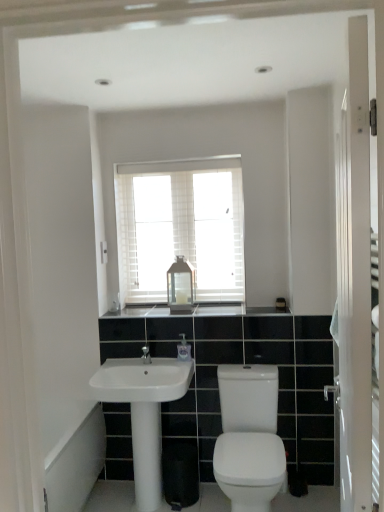
Question: Is black granite countertop at center smaller than white glossy screen door at right?

Choices:
 (A) yes
 (B) no

Answer: (A)

Question: From a real-world perspective, is black granite countertop at center located beneath white glossy screen door at right?

Choices:
 (A) no
 (B) yes

Answer: (B)

Question: Is black granite countertop at center further to the viewer compared to white glossy screen door at right?

Choices:
 (A) no
 (B) yes

Answer: (B)

Question: Can white glossy screen door at right be found inside black granite countertop at center?

Choices:
 (A) yes
 (B) no

Answer: (B)

Question: From a real-world perspective, does black granite countertop at center stand above white glossy screen door at right?

Choices:
 (A) yes
 (B) no

Answer: (B)

Question: Based on their sizes in the image, would you say white glossy toilet at lower right is bigger or smaller than white glossy sink at center?

Choices:
 (A) big
 (B) small

Answer: (A)

Question: From their relative heights in the image, would you say white glossy toilet at lower right is taller or shorter than white glossy sink at center?

Choices:
 (A) tall
 (B) short

Answer: (A)

Question: Considering the positions of point (253, 459) and point (173, 359), is point (253, 459) closer or farther from the camera than point (173, 359)?

Choices:
 (A) closer
 (B) farther

Answer: (A)

Question: In the image, is white glossy toilet at lower right on the left side or the right side of white glossy sink at center?

Choices:
 (A) right
 (B) left

Answer: (A)

Question: Considering the positions of point (140, 461) and point (112, 372), is point (140, 461) closer or farther from the camera than point (112, 372)?

Choices:
 (A) closer
 (B) farther

Answer: (B)

Question: Is white glossy pedestal at center bigger or smaller than white glossy sink at center?

Choices:
 (A) big
 (B) small

Answer: (B)

Question: In the image, is white glossy pedestal at center positioned in front of or behind white glossy sink at center?

Choices:
 (A) behind
 (B) front

Answer: (A)

Question: From the image's perspective, is white glossy pedestal at center located above or below white glossy sink at center?

Choices:
 (A) above
 (B) below

Answer: (B)

Question: Considering the positions of white glossy sink at center and white glossy screen door at right in the image, is white glossy sink at center bigger or smaller than white glossy screen door at right?

Choices:
 (A) big
 (B) small

Answer: (B)

Question: From the image's perspective, relative to white glossy screen door at right, is white glossy sink at center above or below?

Choices:
 (A) below
 (B) above

Answer: (A)